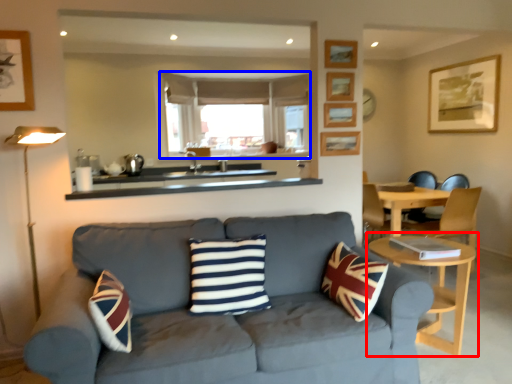
Question: Which object appears closest to the camera in this image, table (highlighted by a red box) or window frame (highlighted by a blue box)?

Choices:
 (A) table
 (B) window frame

Answer: (A)